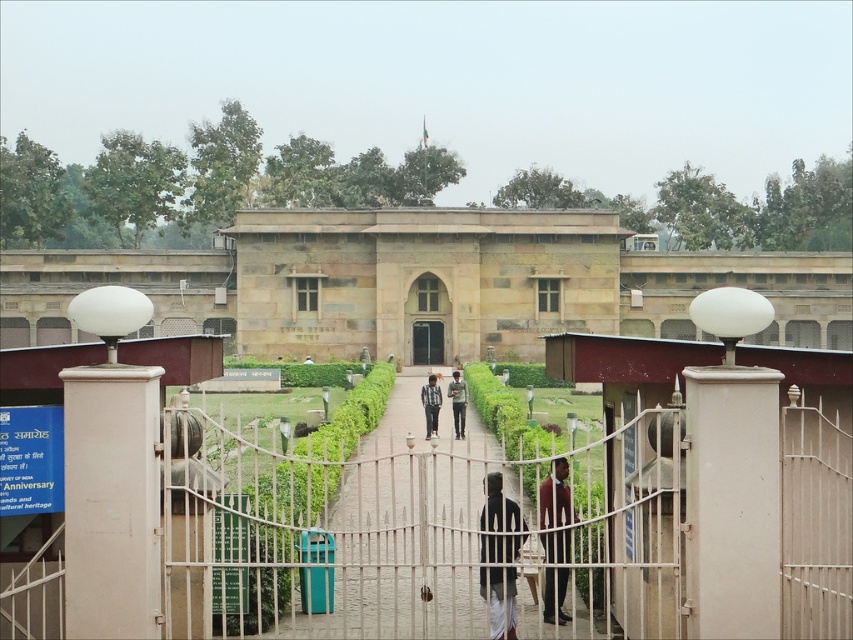
You are a visitor at this historical site and see the dark gray fabric at center and the striped fabric shirt at center. Which one is closer to the ground?

The dark gray fabric at center is positioned under the striped fabric shirt at center, so it is closer to the ground.